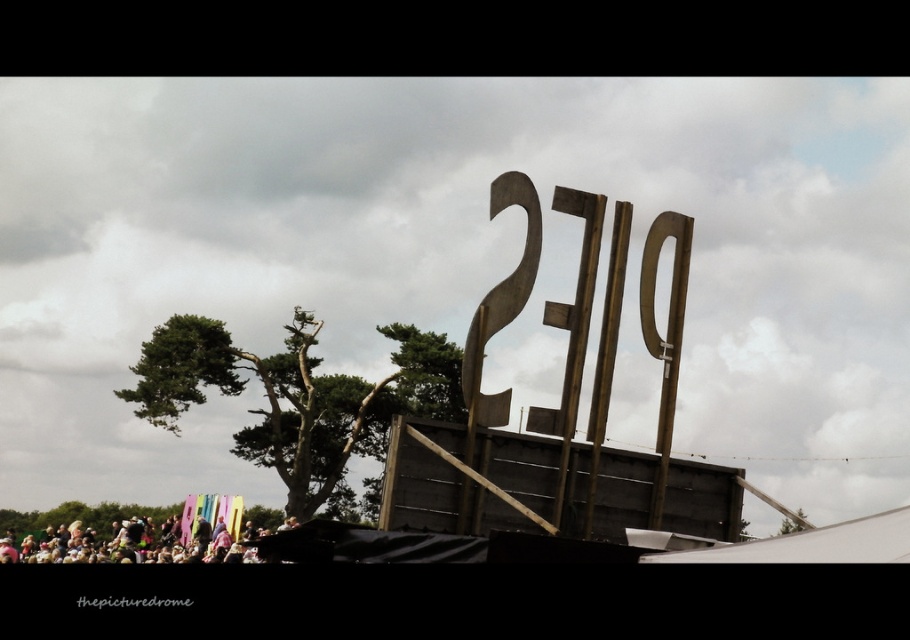
Question: Is green textured tree at center thinner than multicolored fabric at lower left?

Choices:
 (A) no
 (B) yes

Answer: (A)

Question: Can you confirm if green textured tree at center is positioned to the left of multicolored fabric at lower left?

Choices:
 (A) no
 (B) yes

Answer: (A)

Question: Does green textured tree at center have a greater width compared to multicolored fabric at lower left?

Choices:
 (A) no
 (B) yes

Answer: (B)

Question: Which point appears farthest from the camera in this image?

Choices:
 (A) (331, 496)
 (B) (140, 515)

Answer: (A)

Question: Among these points, which one is farthest from the camera?

Choices:
 (A) pos(383,416)
 (B) pos(16,538)

Answer: (A)